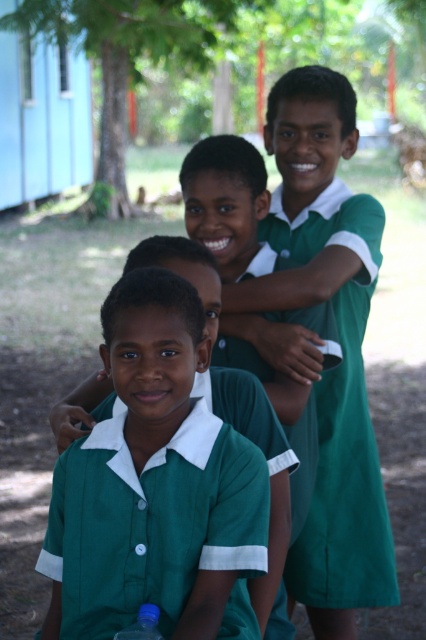
Question: Which of the following is the farthest from the observer?

Choices:
 (A) blue plastic bottle at lower left
 (B) green uniform shirt at center

Answer: (B)

Question: Which point is farther from the camera taking this photo?

Choices:
 (A) (337, 579)
 (B) (124, 506)

Answer: (A)

Question: Considering the relative positions of green matte uniform at center and blue plastic bottle at lower left in the image provided, where is green matte uniform at center located with respect to blue plastic bottle at lower left?

Choices:
 (A) above
 (B) below

Answer: (A)

Question: Is green matte uniform at center wider than blue plastic bottle at lower left?

Choices:
 (A) yes
 (B) no

Answer: (A)

Question: Which point is farther to the camera?

Choices:
 (A) (x=124, y=628)
 (B) (x=169, y=634)

Answer: (B)

Question: Is green uniform shirt at center thinner than green matte uniform at center?

Choices:
 (A) yes
 (B) no

Answer: (A)